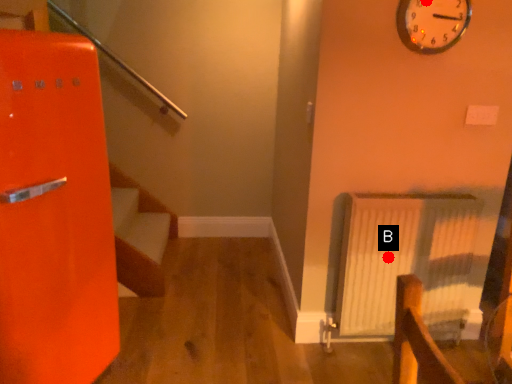
Question: Two points are circled on the image, labeled by A and B beside each circle. Which point appears farthest from the camera in this image?

Choices:
 (A) A is further
 (B) B is further

Answer: (B)